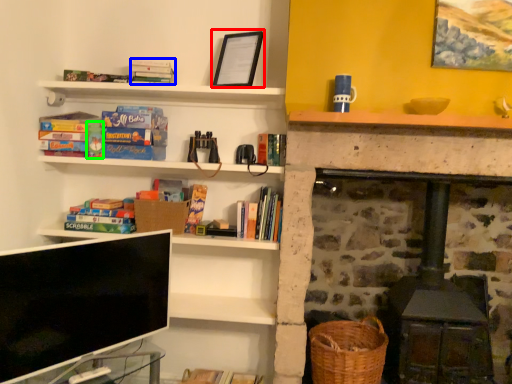
Question: Which object is the farthest from picture frame (highlighted by a red box)? Choose among these: book (highlighted by a blue box) or paperback book (highlighted by a green box).

Choices:
 (A) book
 (B) paperback book

Answer: (B)